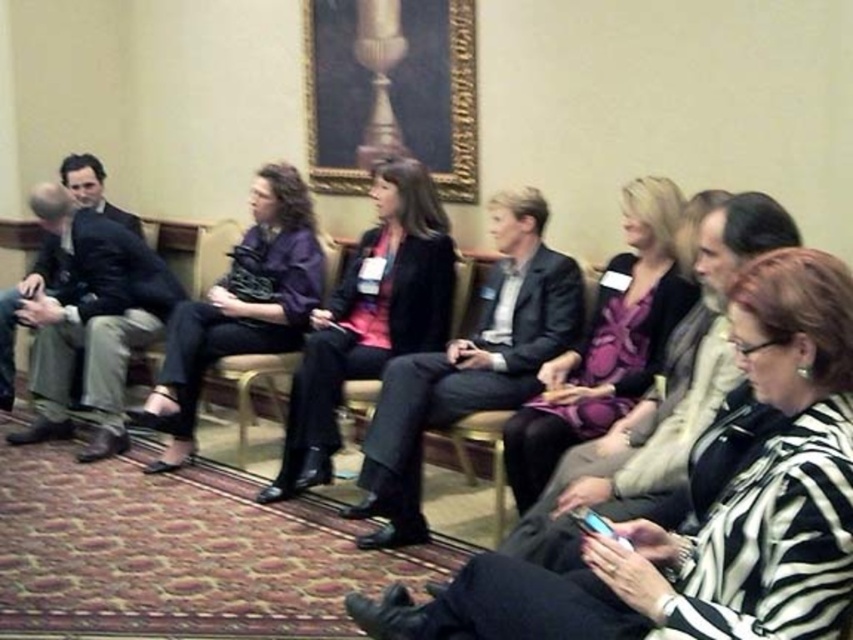
How distant is matte black blazer at center from matte purple blouse at center?

They are 19.77 inches apart.

Who is positioned more to the right, matte black blazer at center or matte purple blouse at center?

matte black blazer at center is more to the right.

Measure the distance between point (430, 237) and camera.

Point (430, 237) is 3.74 meters from camera.

Locate an element on the screen. The width and height of the screenshot is (853, 640). matte black blazer at center is located at coordinates (369, 317).

Between point (198, 381) and point (468, 452), which one is positioned in front?

Positioned in front is point (198, 381).

Is matte purple blouse at center closer to camera compared to metallic gold chair at center?

No, matte purple blouse at center is further to the viewer.

Is point (251, 342) farther from camera compared to point (496, 480)?

Yes, point (251, 342) is behind point (496, 480).

Where is `matte purple blouse at center`? matte purple blouse at center is located at coordinates click(241, 307).

Is zebra-patterned jacket at center thinner than matte purple blouse at center?

Incorrect, zebra-patterned jacket at center's width is not less than matte purple blouse at center's.

Consider the image. Between zebra-patterned jacket at center and matte purple blouse at center, which one appears on the left side from the viewer's perspective?

matte purple blouse at center is more to the left.

Which is behind, point (511, 609) or point (181, 337)?

The point (181, 337) is more distant.

The image size is (853, 640). What are the coordinates of `zebra-patterned jacket at center` in the screenshot? It's located at (706, 512).